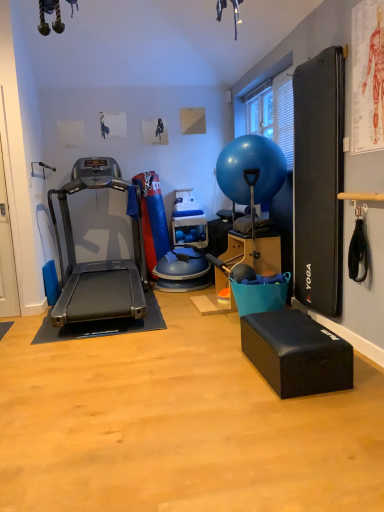
Question: Is blue rubber ball at center inside the boundaries of black rubber treadmill at left, or outside?

Choices:
 (A) outside
 (B) inside

Answer: (A)

Question: Is point (276, 166) closer or farther from the camera than point (99, 316)?

Choices:
 (A) closer
 (B) farther

Answer: (B)

Question: Which object is the farthest from the black foam footrest at lower right?

Choices:
 (A) blue rubber ball at center
 (B) black rubber treadmill at left

Answer: (B)

Question: Which object is the farthest from the black rubber treadmill at left?

Choices:
 (A) black foam footrest at lower right
 (B) blue rubber ball at center

Answer: (A)